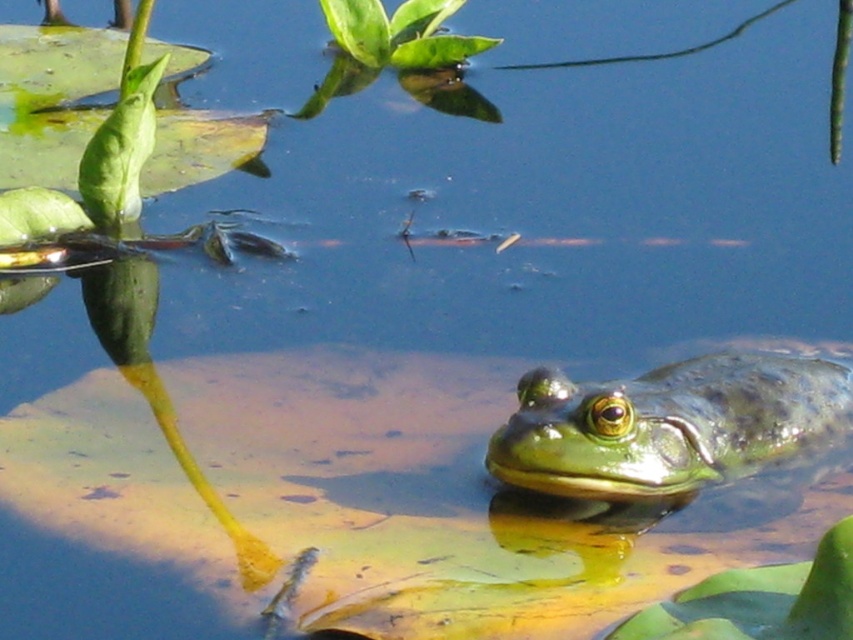
Measure the distance from green rough skin frog at lower right to green leafy plant at upper center.

A distance of 1.00 meters exists between green rough skin frog at lower right and green leafy plant at upper center.

This screenshot has height=640, width=853. What do you see at coordinates (670, 426) in the screenshot?
I see `green rough skin frog at lower right` at bounding box center [670, 426].

Measure the distance between green rough skin frog at lower right and camera.

A distance of 5.21 feet exists between green rough skin frog at lower right and camera.

Where is `green rough skin frog at lower right`? green rough skin frog at lower right is located at coordinates (670, 426).